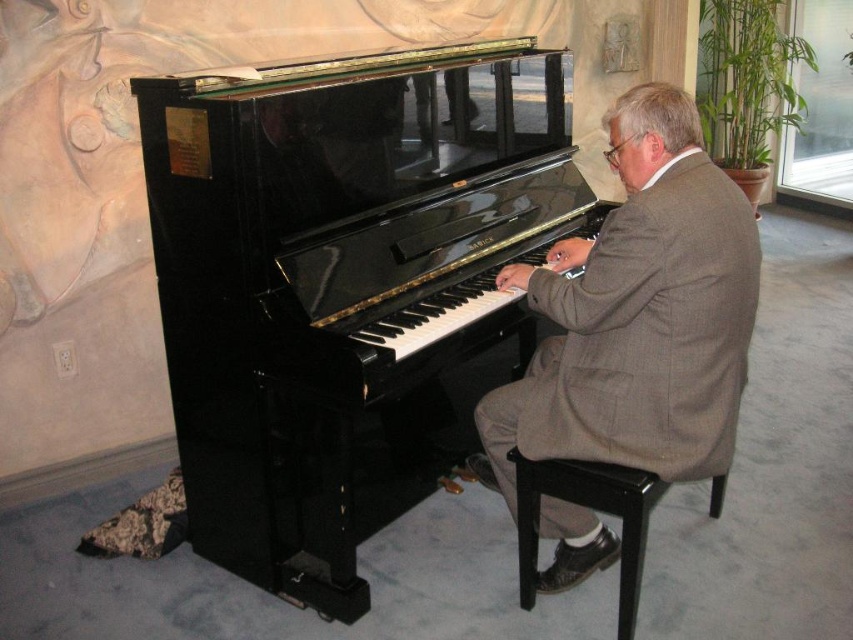
Does black polished piano at center come behind gray wool suit at center?

Yes.

Can you confirm if black polished piano at center is wider than gray wool suit at center?

Yes, black polished piano at center is wider than gray wool suit at center.

Locate an element on the screen. The height and width of the screenshot is (640, 853). black polished piano at center is located at coordinates (340, 285).

Can you confirm if black polished piano at center is positioned to the right of black wood stool at lower center?

No, black polished piano at center is not to the right of black wood stool at lower center.

Which is below, black polished piano at center or black wood stool at lower center?

black wood stool at lower center

Describe the element at coordinates (340, 285) in the screenshot. I see `black polished piano at center` at that location.

I want to click on black polished piano at center, so click(340, 285).

Does gray wool suit at center have a larger size compared to black wood stool at lower center?

Yes.

Is the position of gray wool suit at center more distant than that of black wood stool at lower center?

That is False.

Is point (740, 390) farther from viewer compared to point (527, 481)?

No, it is not.

Locate an element on the screen. gray wool suit at center is located at coordinates (637, 316).